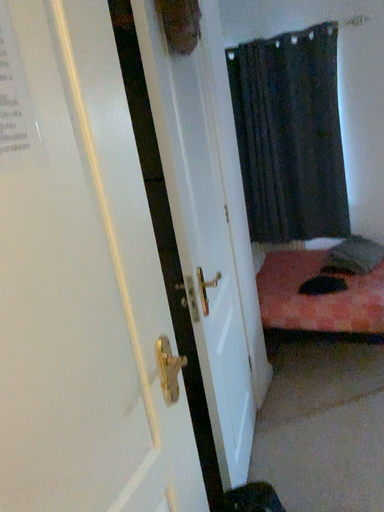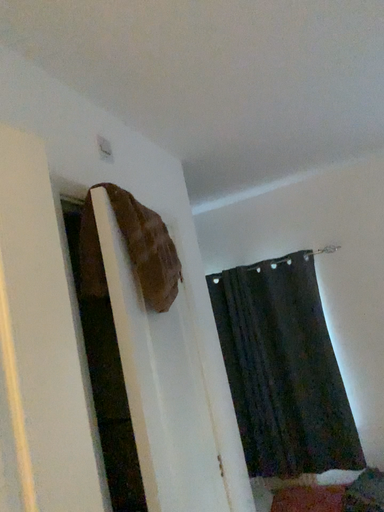
Question: How did the camera likely rotate when shooting the video?

Choices:
 (A) rotated upward
 (B) rotated downward

Answer: (A)